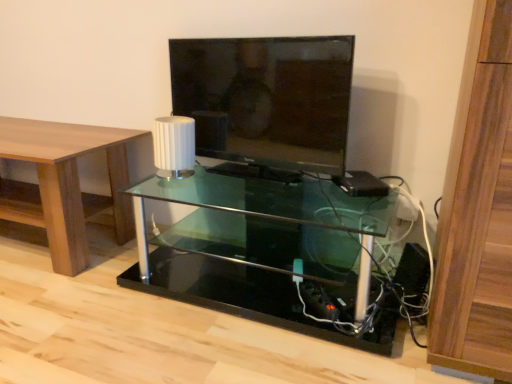
Question: Looking at their shapes, would you say black plastic speaker at lower right is wider or thinner than wooden table at left?

Choices:
 (A) wide
 (B) thin

Answer: (B)

Question: From a real-world perspective, relative to wooden table at left, is black plastic speaker at lower right vertically above or below?

Choices:
 (A) above
 (B) below

Answer: (B)

Question: Considering the real-world distances, which object is farthest from the white matte lamp at center?

Choices:
 (A) black plastic speaker at lower right
 (B) matte black tv at center
 (C) wooden table at left
 (D) transparent glass shelf at center

Answer: (A)

Question: Which object is the farthest from the wooden table at left?

Choices:
 (A) black plastic speaker at lower right
 (B) matte black tv at center
 (C) transparent glass shelf at center
 (D) white matte lamp at center

Answer: (A)